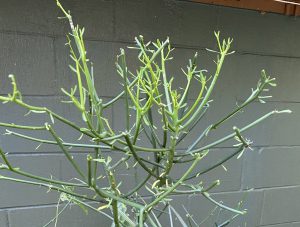
Locate an element on the screen. plant is located at coordinates (150, 174).